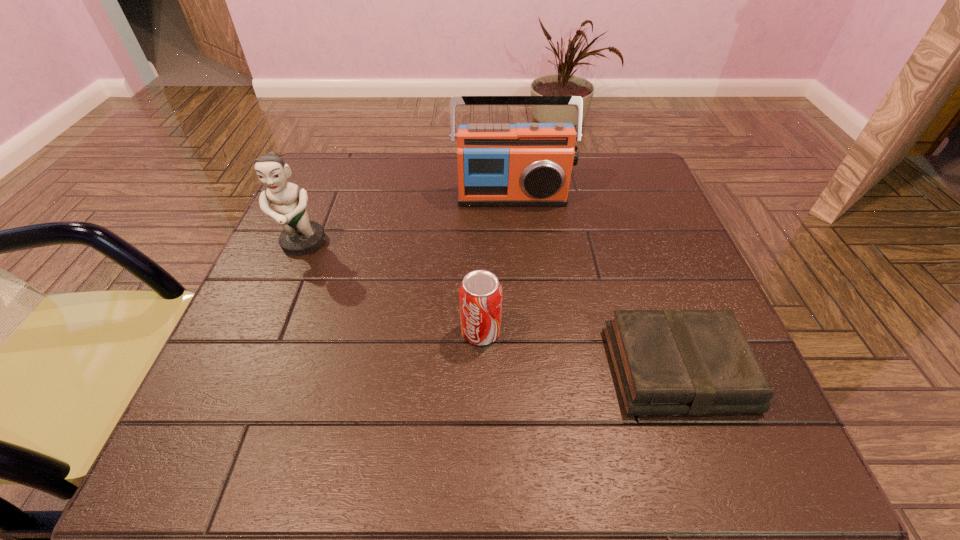
Where is `object situated at the near edge`? The height and width of the screenshot is (540, 960). object situated at the near edge is located at coordinates (x=666, y=362).

Where is `object that is at the left edge`? object that is at the left edge is located at coordinates (300, 236).

Image resolution: width=960 pixels, height=540 pixels. What are the coordinates of `object present at the right edge` in the screenshot? It's located at (666, 362).

You are a GUI agent. You are given a task and a screenshot of the screen. Output one action in this format:
    pyautogui.click(x=<x>, y=<y>)
    Task: Click on the object at the near right corner
    The image size is (960, 540).
    Given the screenshot: What is the action you would take?
    pyautogui.click(x=666, y=362)

This screenshot has width=960, height=540. In the image, there is a desktop. Find the location of `free space at the far edge`. free space at the far edge is located at coordinates (397, 167).

Identify the location of vacant region at the near edge of the desktop. This screenshot has width=960, height=540. (446, 469).

In order to click on vacant region at the left edge of the desktop in this screenshot , I will do `click(252, 389)`.

You are a GUI agent. You are given a task and a screenshot of the screen. Output one action in this format:
    pyautogui.click(x=<x>, y=<y>)
    Task: Click on the blank space at the right edge of the desktop
    The width and height of the screenshot is (960, 540).
    Given the screenshot: What is the action you would take?
    pyautogui.click(x=690, y=285)

The width and height of the screenshot is (960, 540). In order to click on blank space at the far left corner of the desktop in this screenshot , I will do `click(362, 188)`.

In the image, there is a desktop. At what (x,y) coordinates should I click in order to perform the action: click on free region at the far right corner. Please return your answer as a coordinate pair (x, y). The image size is (960, 540). Looking at the image, I should click on (629, 195).